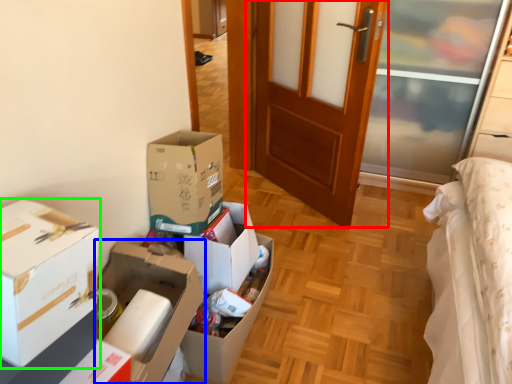
Question: Which is farther away from door (highlighted by a red box)? box (highlighted by a blue box) or box (highlighted by a green box)?

Choices:
 (A) box
 (B) box

Answer: (B)